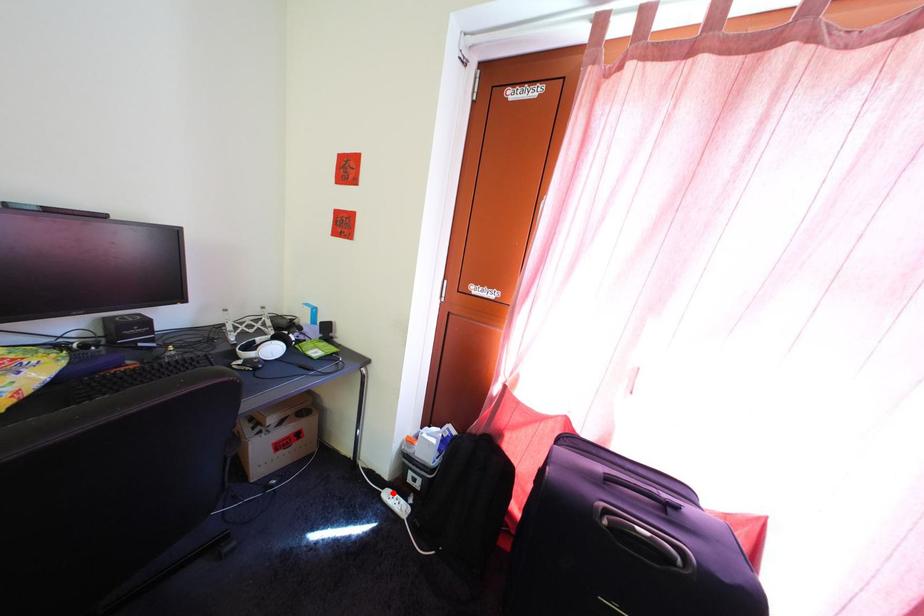
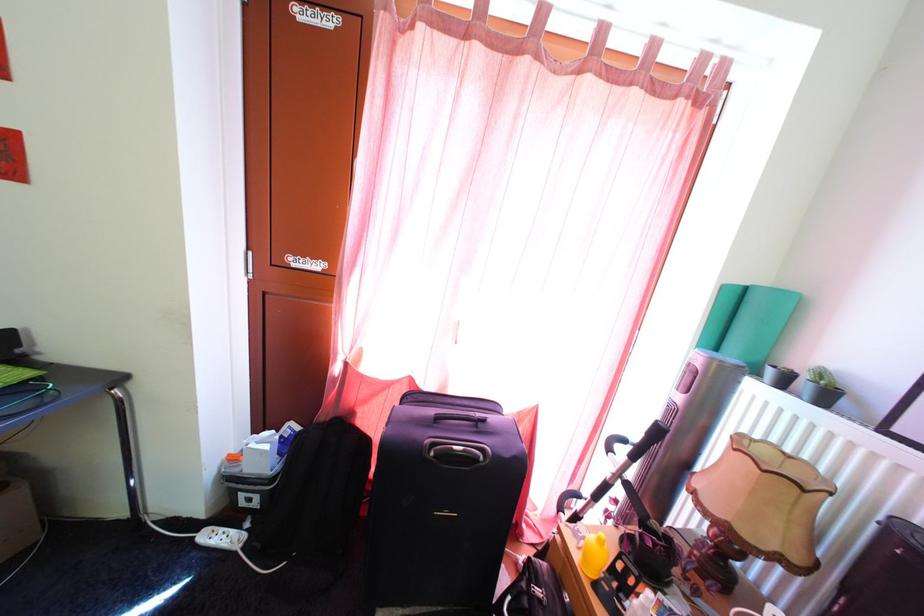
Where in the second image is the point corresponding to the highlighted location from the first image?

(208, 533)